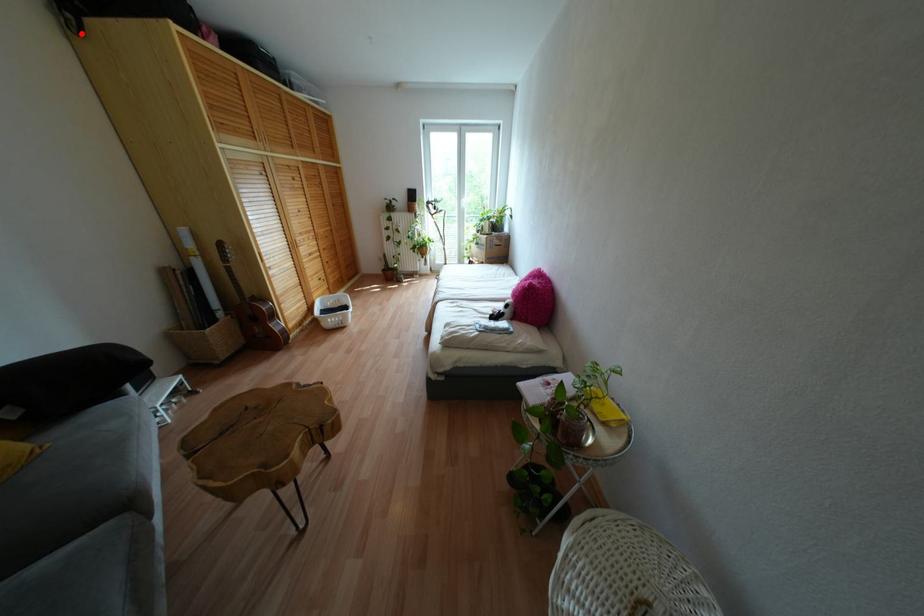
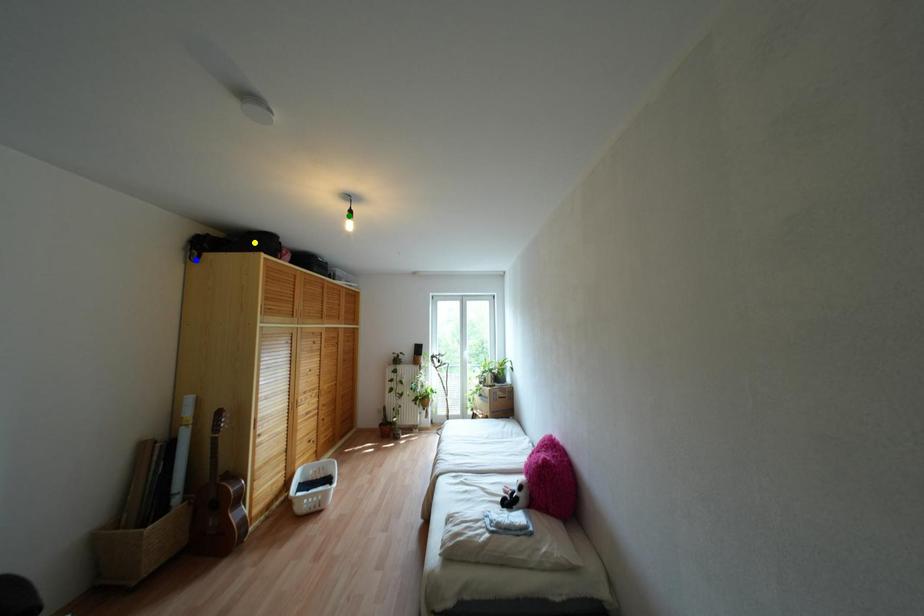
Question: I am providing you with two images of the same scene from different viewpoints. A red point is marked on the first image. You are given multiple points on the second image. Which point in image 2 is actually the same real-world point as the red point in image 1?

Choices:
 (A) yellow point
 (B) green point
 (C) blue point

Answer: (C)